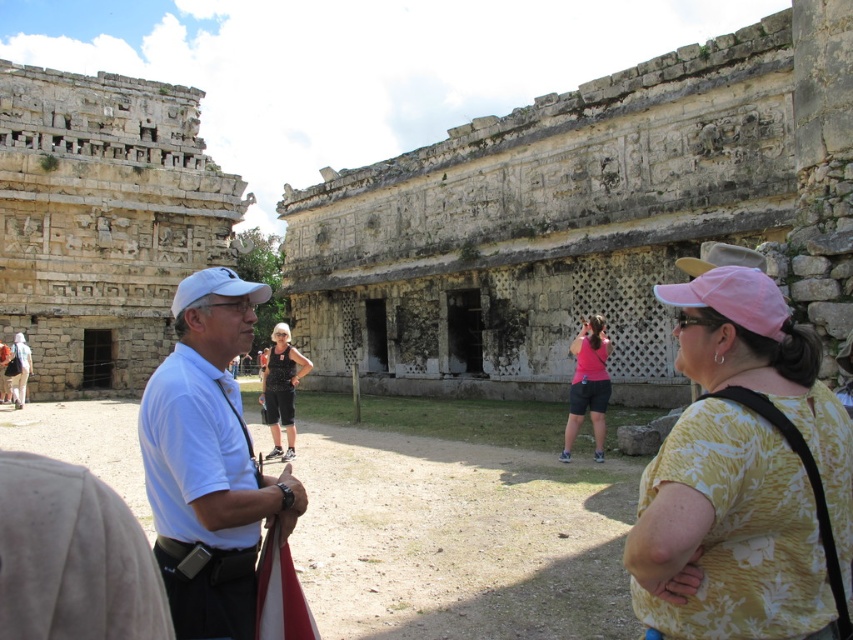
You are a photographer trying to capture a clear shot of the white shirt at center and the white fabric baseball cap at center. Considering their sizes, which object should you focus on first to ensure both are in frame without needing to adjust your camera angle?

The white shirt at center has a larger size compared to the white fabric baseball cap at center. Therefore, focus on the white shirt at center first since it is bigger and will occupy more of the frame, ensuring both objects remain in view without needing adjustments.

You are a tour guide at the archaeological site. You notice a tourist wearing a white shirt at center and a white fabric baseball cap at center. Can you determine which item is positioned lower on their body?

The white shirt at center is located below the white fabric baseball cap at center, so the white shirt at center is positioned lower on their body.

You are a photographer positioned at the stone textured ruins at left and want to take a photo of the white fabric baseball cap at center. Since the ruins are closer to you, will they block your view of the cap?

The stone textured ruins at left are further to the viewer than the white fabric baseball cap at center, so the ruins are actually behind the cap. This means the ruins won